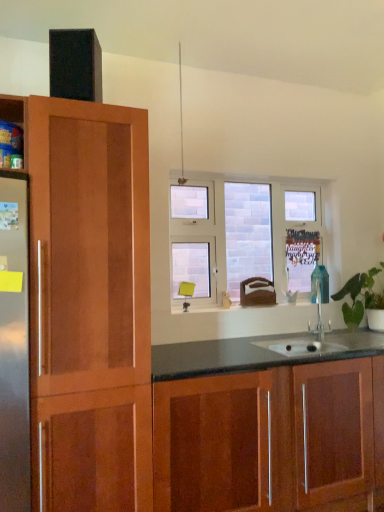
Question: From their relative heights in the image, would you say clear glass window at center is taller or shorter than green leafy plant at right?

Choices:
 (A) tall
 (B) short

Answer: (A)

Question: From a real-world perspective, is clear glass window at center physically located above or below green leafy plant at right?

Choices:
 (A) above
 (B) below

Answer: (A)

Question: Considering the real-world distances, which object is farthest from the green leafy plant at right?

Choices:
 (A) clear glass window at center
 (B) glossy wood cabinets at lower center

Answer: (B)

Question: Which is farther from the clear glass window at center?

Choices:
 (A) green leafy plant at right
 (B) glossy wood cabinets at lower center

Answer: (B)